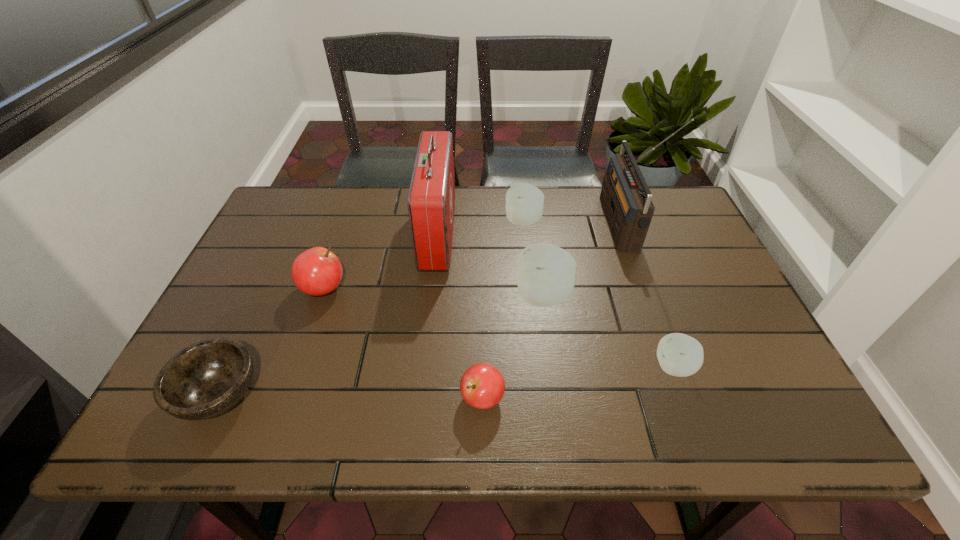
Find the location of `the tallest object`. the tallest object is located at coordinates (625, 196).

The height and width of the screenshot is (540, 960). I want to click on the first-aid kit, so click(431, 199).

At what (x,y) coordinates should I click in order to perform the action: click on the third object from left to right. Please return your answer as a coordinate pair (x, y). This screenshot has width=960, height=540. Looking at the image, I should click on (431, 199).

You are a GUI agent. You are given a task and a screenshot of the screen. Output one action in this format:
    pyautogui.click(x=<x>, y=<y>)
    Task: Click on the second farthest white apple
    
    Given the screenshot: What is the action you would take?
    pyautogui.click(x=545, y=276)

This screenshot has width=960, height=540. I want to click on the biggest white apple, so click(x=545, y=276).

The height and width of the screenshot is (540, 960). Identify the location of the second biggest white apple. (524, 206).

The image size is (960, 540). What are the coordinates of `the farthest white apple` in the screenshot? It's located at coord(524,206).

At what (x,y) coordinates should I click in order to perform the action: click on the farther red apple. Please return your answer as a coordinate pair (x, y). The height and width of the screenshot is (540, 960). Looking at the image, I should click on (317, 271).

Identify the location of the bigger red apple. The image size is (960, 540). (317, 271).

You are a GUI agent. You are given a task and a screenshot of the screen. Output one action in this format:
    pyautogui.click(x=<x>, y=<y>)
    Task: Click on the smallest white apple
    
    Given the screenshot: What is the action you would take?
    pyautogui.click(x=680, y=355)